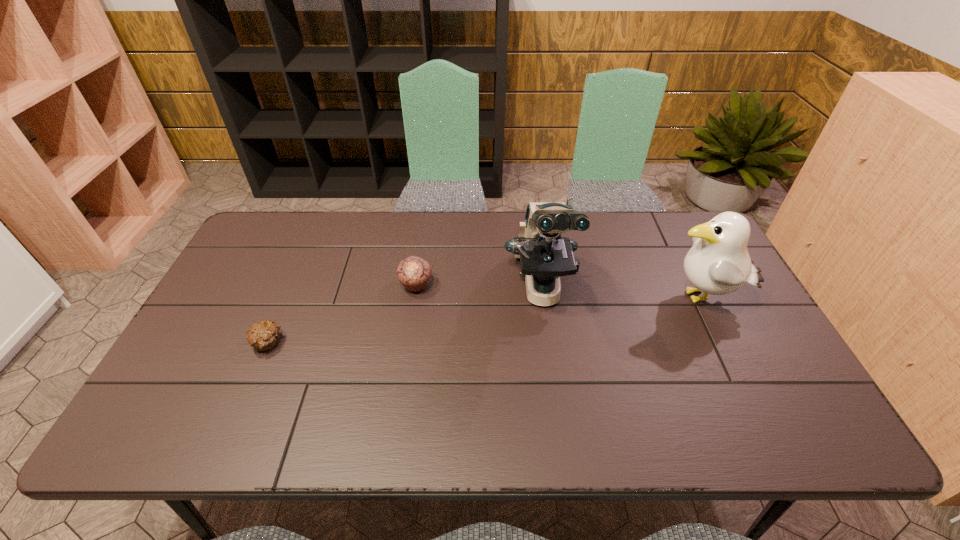
Find the location of a particular element. vacant area located 0.390m on the beak of the gull is located at coordinates (525, 298).

The height and width of the screenshot is (540, 960). I want to click on vacant space located on the beak of the gull, so click(602, 298).

The image size is (960, 540). I want to click on vacant space situated on the left of the right muffin, so click(x=316, y=285).

Find the location of a particular element. Image resolution: width=960 pixels, height=540 pixels. vacant space situated 0.230m on the right of the nearer muffin is located at coordinates (371, 343).

Locate an element on the screen. object positioned at the far edge is located at coordinates (544, 255).

Find the location of a particular element. Image resolution: width=960 pixels, height=540 pixels. object at the right edge is located at coordinates (718, 263).

You are a GUI agent. You are given a task and a screenshot of the screen. Output one action in this format:
    pyautogui.click(x=<x>, y=<y>)
    Task: Click on the vacant space at the far edge of the desktop
    This screenshot has height=540, width=960.
    Given the screenshot: What is the action you would take?
    pyautogui.click(x=377, y=219)

In the image, there is a desktop. Identify the location of blank space at the near edge. The height and width of the screenshot is (540, 960). (553, 411).

Locate an element on the screen. This screenshot has height=540, width=960. free space at the left edge of the desktop is located at coordinates (243, 312).

Locate an element on the screen. vacant region at the right edge of the desktop is located at coordinates (787, 397).